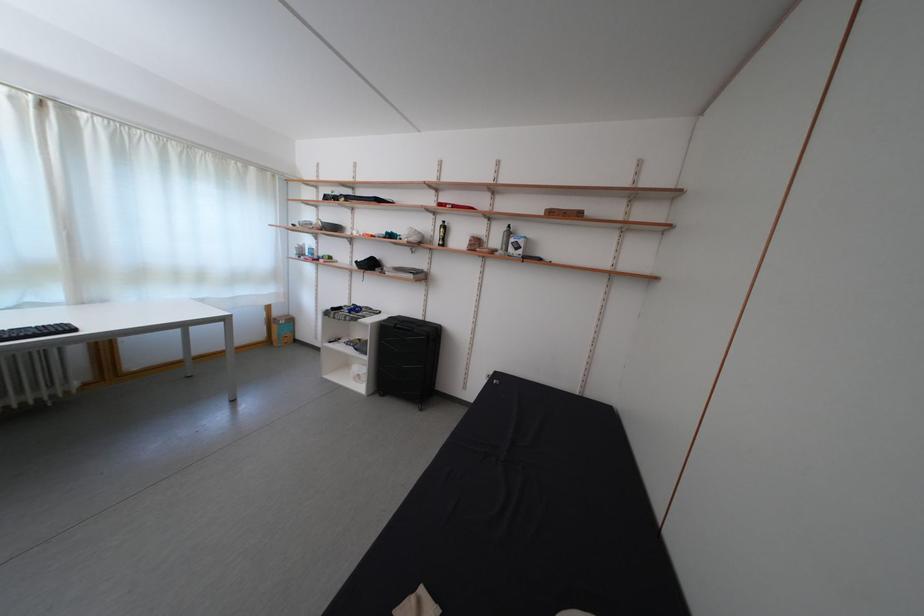
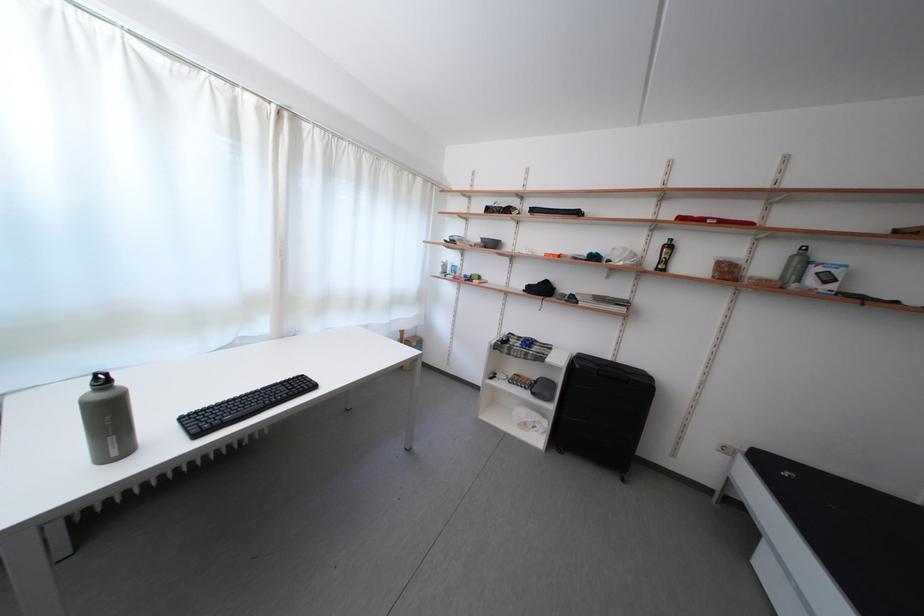
In the second image, find the point that corresponds to pixel 448 228 in the first image.

(669, 246)